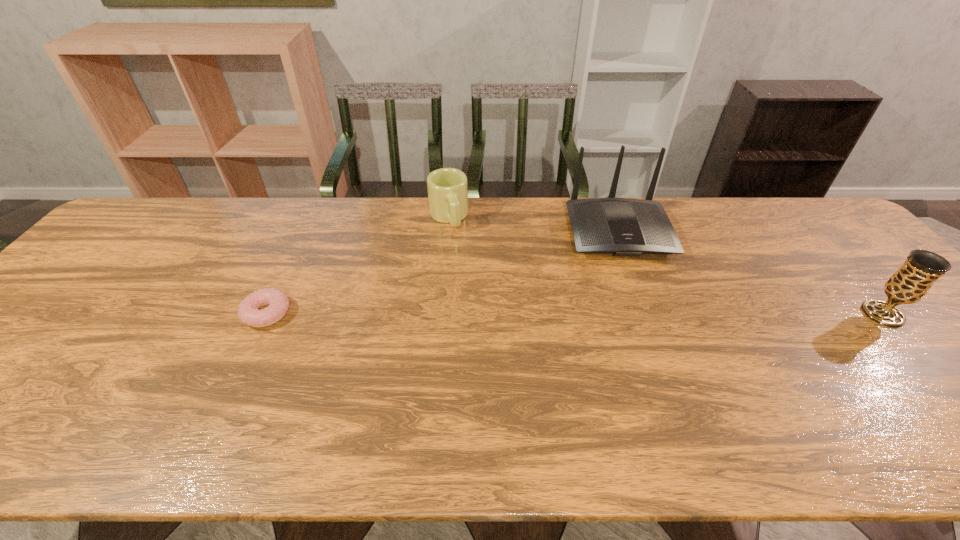
Where is `vacant space on the desktop that is between the doughnut and the third shortest object and is positioned with the handle on the side of the third object from right to left`? This screenshot has height=540, width=960. vacant space on the desktop that is between the doughnut and the third shortest object and is positioned with the handle on the side of the third object from right to left is located at coordinates (485, 314).

At what (x,y) coordinates should I click in order to perform the action: click on free space on the desktop that is between the shortest object and the third shortest object and is positioned on the front-facing side of the router. Please return your answer as a coordinate pair (x, y). Looking at the image, I should click on (645, 314).